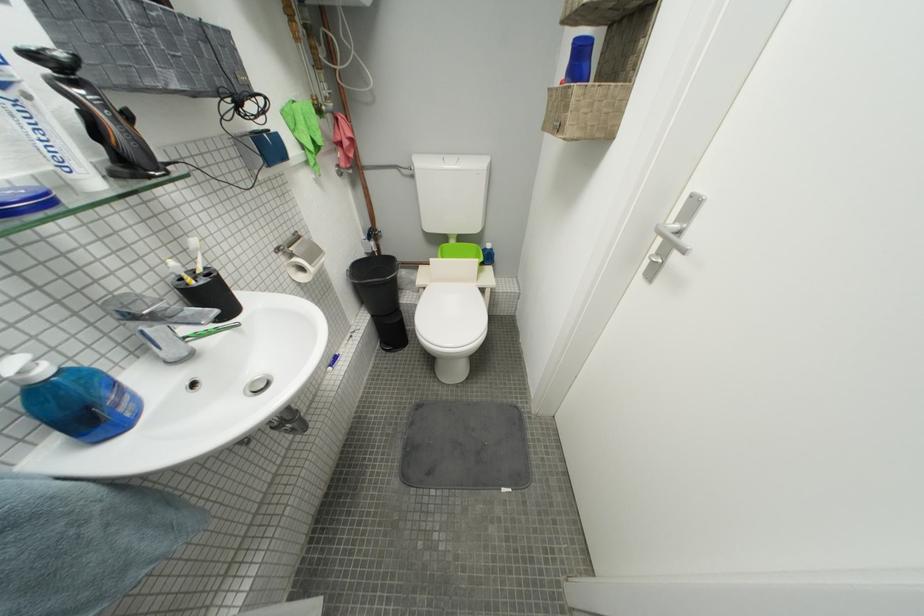
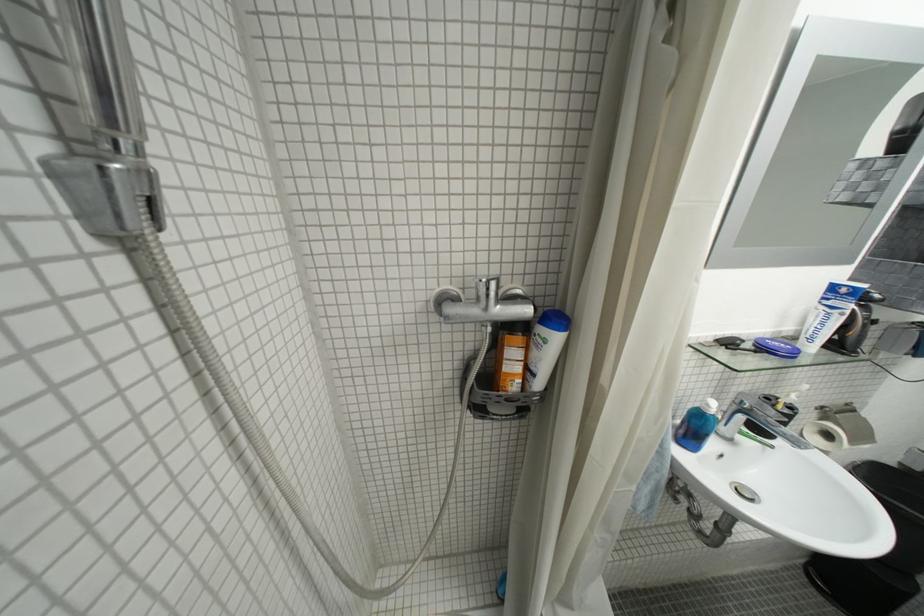
Find the pixel in the second image that matches point 310,270 in the first image.

(836, 438)